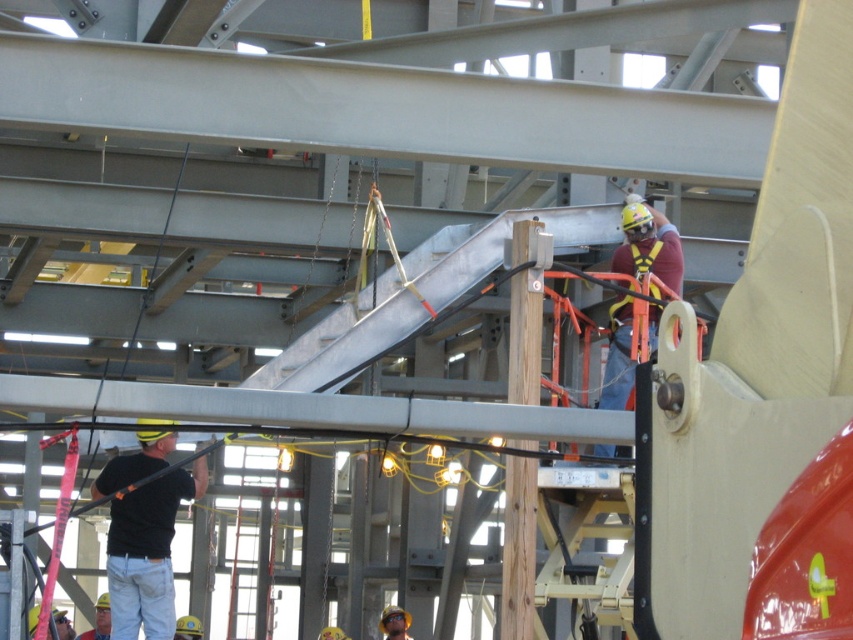
Question: Is black matte shirt at lower left further to the viewer compared to yellow hard hat at lower left?

Choices:
 (A) no
 (B) yes

Answer: (A)

Question: Which point is farther to the camera?

Choices:
 (A) (630, 244)
 (B) (120, 486)
 (C) (210, 413)
 (D) (490, 106)

Answer: (A)

Question: Which is nearer to the black matte shirt at lower left?

Choices:
 (A) metallic gray beam at center
 (B) yellow safety harness at upper center
 (C) gray metallic beam at upper center

Answer: (B)

Question: Can you confirm if black matte shirt at lower left is wider than yellow hard hat at lower left?

Choices:
 (A) no
 (B) yes

Answer: (A)

Question: Which object is farther from the camera taking this photo?

Choices:
 (A) yellow hard hat at lower left
 (B) metallic gray beam at center
 (C) black matte shirt at lower left
 (D) yellow safety harness at upper center

Answer: (A)

Question: Can you confirm if black matte shirt at lower left is wider than yellow safety harness at upper center?

Choices:
 (A) no
 (B) yes

Answer: (B)